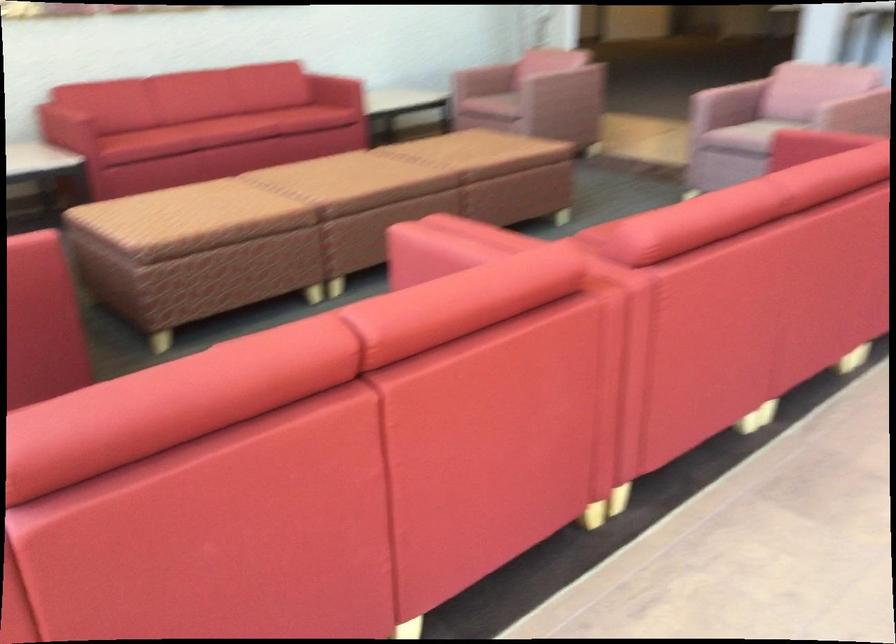
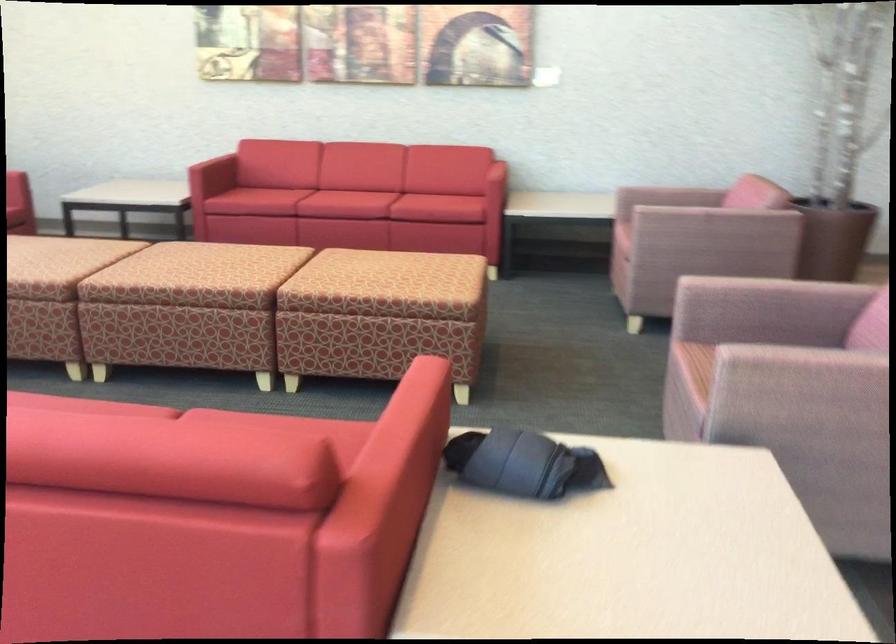
Where in the second image is the point corresponding to point (712, 93) from the first image?

(728, 278)